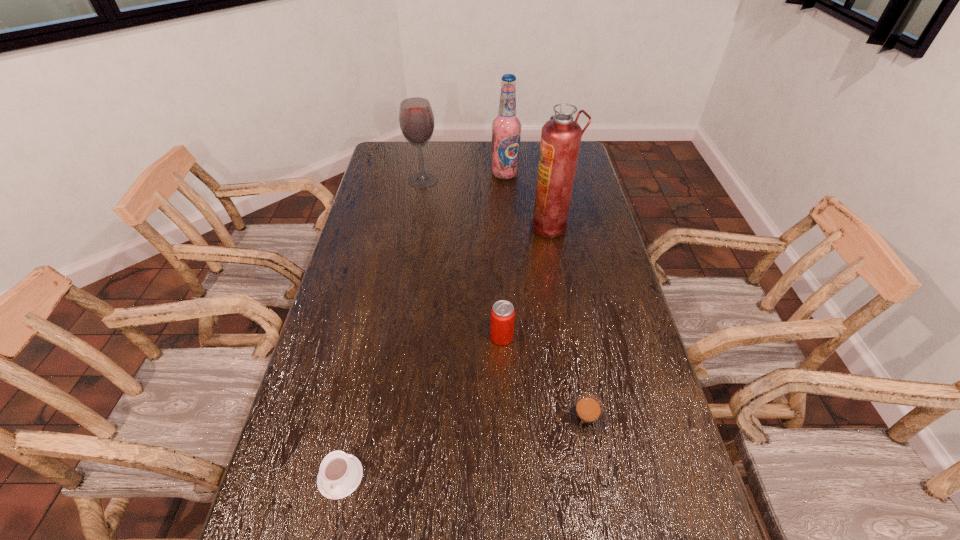
Find the location of a particular element. cappuccino that is at the right edge is located at coordinates (585, 414).

You are a GUI agent. You are given a task and a screenshot of the screen. Output one action in this format:
    pyautogui.click(x=<x>, y=<y>)
    Task: Click on the free space at the far edge of the desktop
    
    Given the screenshot: What is the action you would take?
    pyautogui.click(x=448, y=152)

Locate an element on the screen. free space at the left edge is located at coordinates coord(288,495).

Identify the location of vacant area at the right edge of the desktop. (620, 382).

Image resolution: width=960 pixels, height=540 pixels. In the image, there is a desktop. What are the coordinates of `vacant space at the far left corner` in the screenshot? It's located at (387, 143).

You are a GUI agent. You are given a task and a screenshot of the screen. Output one action in this format:
    pyautogui.click(x=<x>, y=<y>)
    Task: Click on the vacant space that is in between the right alcohol and the nearest object
    The width and height of the screenshot is (960, 540).
    Given the screenshot: What is the action you would take?
    pyautogui.click(x=422, y=325)

At what (x,y) coordinates should I click in order to perform the action: click on vacant space that's between the fire extinguisher and the shorter alcohol. Please return your answer as a coordinate pair (x, y). Looking at the image, I should click on (487, 203).

The image size is (960, 540). Identify the location of unoccupied position between the fourth nearest object and the teacup. (445, 352).

Where is `free area in between the fourth shortest object and the taller alcohol`? This screenshot has width=960, height=540. free area in between the fourth shortest object and the taller alcohol is located at coordinates (464, 177).

Identify the location of vacant area that lies between the fourth shortest object and the can. (463, 258).